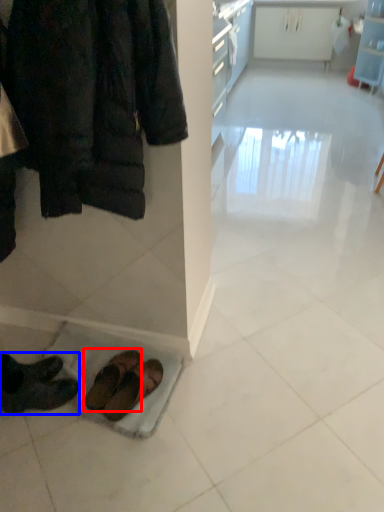
Question: Which point is closer to the camera, footwear (highlighted by a red box) or footwear (highlighted by a blue box)?

Choices:
 (A) footwear
 (B) footwear

Answer: (B)